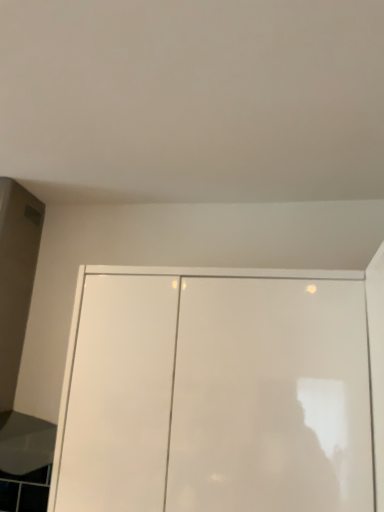
Describe the element at coordinates (215, 392) in the screenshot. The height and width of the screenshot is (512, 384). I see `white glossy cupboard at center` at that location.

Where is `white glossy cupboard at center`? white glossy cupboard at center is located at coordinates (215, 392).

Where is `white glossy cupboard at center`? Image resolution: width=384 pixels, height=512 pixels. white glossy cupboard at center is located at coordinates (215, 392).